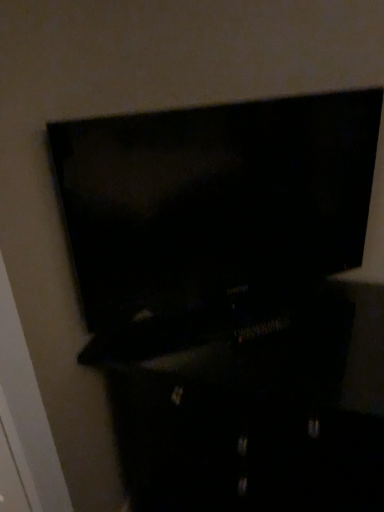
Image resolution: width=384 pixels, height=512 pixels. In order to click on free point above black glossy dresser at center (from a real-world perspective) in this screenshot , I will do `click(287, 333)`.